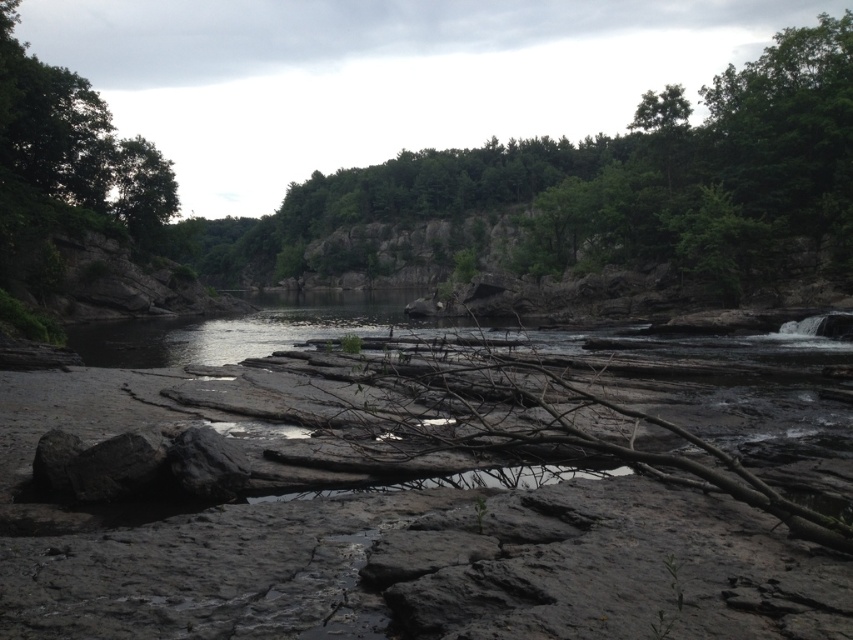
Question: Is green leafy tree at upper center above green leafy tree at upper left?

Choices:
 (A) yes
 (B) no

Answer: (A)

Question: Can you confirm if green leafy tree at upper center is bigger than green leafy tree at upper left?

Choices:
 (A) yes
 (B) no

Answer: (A)

Question: Which object appears closest to the camera in this image?

Choices:
 (A) green leafy tree at upper center
 (B) green leafy tree at upper left

Answer: (B)

Question: Can you confirm if green leafy tree at upper center is thinner than green leafy tree at upper left?

Choices:
 (A) no
 (B) yes

Answer: (A)

Question: Which object appears farthest from the camera in this image?

Choices:
 (A) green leafy tree at upper left
 (B) green leafy tree at upper center

Answer: (B)

Question: Which of the following is the farthest from the observer?

Choices:
 (A) green leafy tree at upper left
 (B) green leafy tree at upper center

Answer: (B)